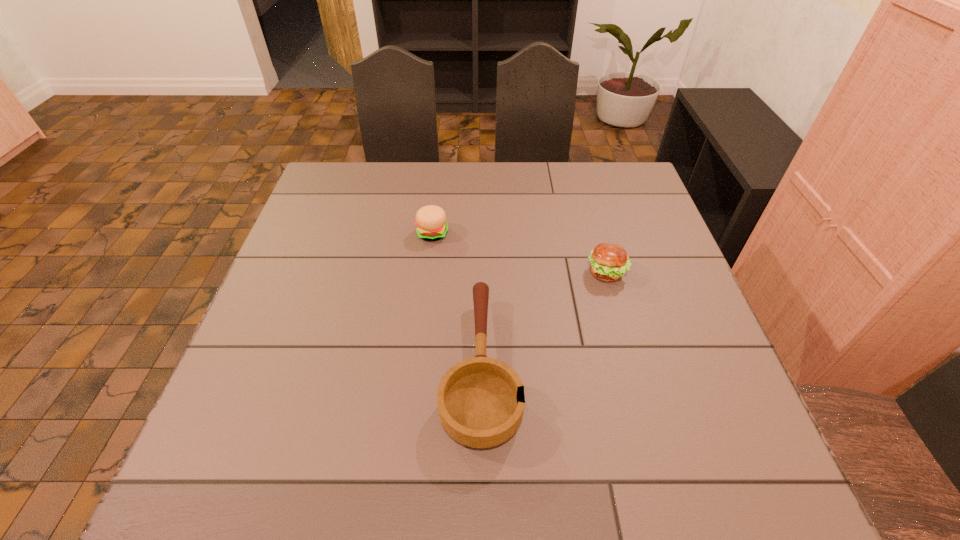
Where is `object that stands as the second closest to the right hamburger`? object that stands as the second closest to the right hamburger is located at coordinates (431, 223).

This screenshot has width=960, height=540. Find the location of `vacant area that satisfies the following two spatial constraints: 1. on the front side of the rightmost object; 2. on the left side of the leftmost object`. vacant area that satisfies the following two spatial constraints: 1. on the front side of the rightmost object; 2. on the left side of the leftmost object is located at coordinates (428, 273).

Locate an element on the screen. vacant region that satisfies the following two spatial constraints: 1. with the handle on the side of the saucepan; 2. on the left side of the right hamburger is located at coordinates (x=481, y=273).

The width and height of the screenshot is (960, 540). What are the coordinates of `free space that satisfies the following two spatial constraints: 1. on the front side of the left hamburger; 2. on the right side of the second nearest object` in the screenshot? It's located at (428, 273).

Locate an element on the screen. This screenshot has height=540, width=960. blank space that satisfies the following two spatial constraints: 1. on the front side of the farthest object; 2. on the left side of the second nearest object is located at coordinates (428, 273).